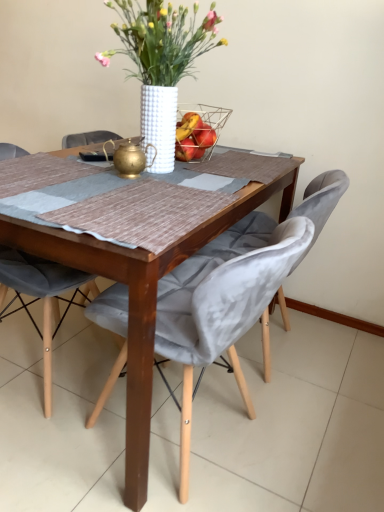
The width and height of the screenshot is (384, 512). What are the coordinates of `free location in front of gold metallic teapot at center` in the screenshot? It's located at (112, 190).